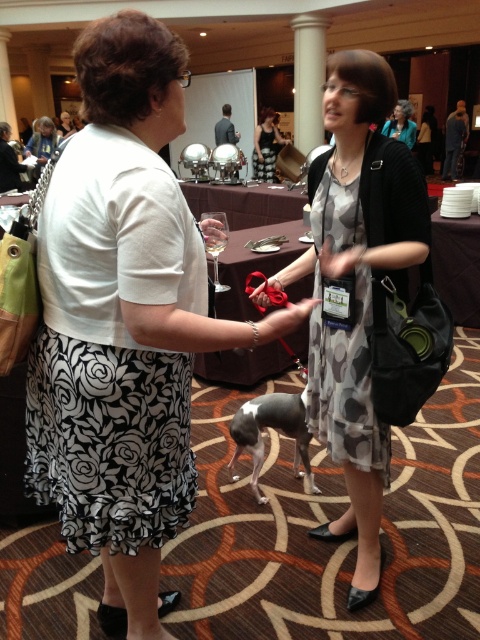
Does black floral skirt at left lie behind matte black dress at center?

No, it is in front of matte black dress at center.

Can you confirm if black floral skirt at left is positioned below matte black dress at center?

Yes.

I want to click on black floral skirt at left, so click(x=111, y=348).

Is point (294, 326) positioned after point (320, 307)?

No, it is in front of (320, 307).

Consider the image. Can you confirm if white cotton blouse at center is positioned to the left of printed chiffon dress at center?

Indeed, white cotton blouse at center is positioned on the left side of printed chiffon dress at center.

Does point (157, 168) come behind point (328, 380)?

No, it is not.

Where is `white cotton blouse at center`? The height and width of the screenshot is (640, 480). white cotton blouse at center is located at coordinates (123, 323).

Is white cotton blouse at center above black floral skirt at left?

Incorrect, white cotton blouse at center is not positioned above black floral skirt at left.

Based on the photo, between white cotton blouse at center and black floral skirt at left, which one appears on the left side from the viewer's perspective?

Positioned to the left is black floral skirt at left.

Locate an element on the screen. Image resolution: width=480 pixels, height=640 pixels. white cotton blouse at center is located at coordinates pyautogui.click(x=123, y=323).